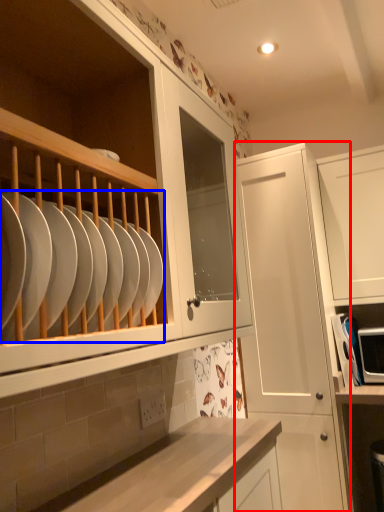
Question: Which of the following is the farthest to the observer, cabinetry (highlighted by a red box) or tableware (highlighted by a blue box)?

Choices:
 (A) cabinetry
 (B) tableware

Answer: (A)